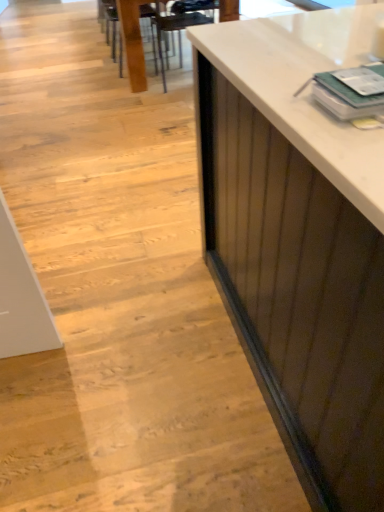
Question: Should I look upward or downward to see wooden table at center?

Choices:
 (A) up
 (B) down

Answer: (A)

Question: Does wooden chair at upper center have a lesser width compared to metallic dark brown armchair at upper center?

Choices:
 (A) no
 (B) yes

Answer: (B)

Question: Is wooden chair at upper center taller than metallic dark brown armchair at upper center?

Choices:
 (A) no
 (B) yes

Answer: (A)

Question: Does wooden chair at upper center have a greater width compared to metallic dark brown armchair at upper center?

Choices:
 (A) no
 (B) yes

Answer: (A)

Question: Is the depth of wooden chair at upper center greater than that of metallic dark brown armchair at upper center?

Choices:
 (A) no
 (B) yes

Answer: (B)

Question: Are wooden chair at upper center and metallic dark brown armchair at upper center located far from each other?

Choices:
 (A) no
 (B) yes

Answer: (A)

Question: Is wooden chair at upper center oriented towards metallic dark brown armchair at upper center?

Choices:
 (A) yes
 (B) no

Answer: (B)

Question: From a real-world perspective, is metallic dark brown armchair at upper center physically below wooden table at center?

Choices:
 (A) yes
 (B) no

Answer: (B)

Question: Is metallic dark brown armchair at upper center smaller than wooden table at center?

Choices:
 (A) yes
 (B) no

Answer: (A)

Question: From the image's perspective, does metallic dark brown armchair at upper center appear lower than wooden table at center?

Choices:
 (A) no
 (B) yes

Answer: (B)

Question: Does metallic dark brown armchair at upper center have a larger size compared to wooden table at center?

Choices:
 (A) yes
 (B) no

Answer: (B)

Question: Is the depth of metallic dark brown armchair at upper center less than that of wooden table at center?

Choices:
 (A) no
 (B) yes

Answer: (B)

Question: Can you confirm if metallic dark brown armchair at upper center is taller than wooden table at center?

Choices:
 (A) yes
 (B) no

Answer: (B)

Question: Is wooden table at center at the left side of metallic dark brown armchair at upper center?

Choices:
 (A) yes
 (B) no

Answer: (A)